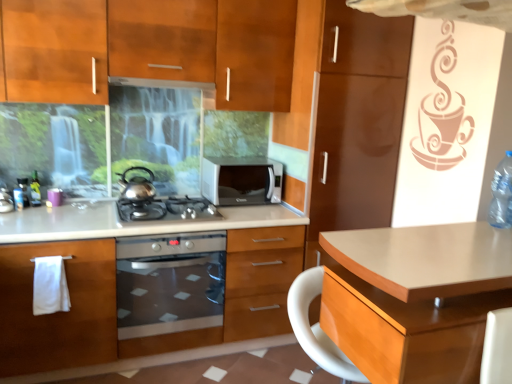
Question: Is metallic silver bottle at left, the second bottle viewed from the right, at the right side of clear plastic bottle at right, arranged as the first bottle when viewed from the right?

Choices:
 (A) no
 (B) yes

Answer: (A)

Question: Is metallic silver bottle at left, positioned as the 1th bottle in left-to-right order, far from clear plastic bottle at right, which ranks as the first bottle in front-to-back order?

Choices:
 (A) yes
 (B) no

Answer: (A)

Question: From the image's perspective, is metallic silver bottle at left, the second bottle viewed from the right, below clear plastic bottle at right, arranged as the first bottle when viewed from the right?

Choices:
 (A) yes
 (B) no

Answer: (B)

Question: Does metallic silver bottle at left, positioned as the 1th bottle in left-to-right order, lie behind clear plastic bottle at right, placed as the second bottle when sorted from left to right?

Choices:
 (A) yes
 (B) no

Answer: (A)

Question: Can you confirm if metallic silver bottle at left, which is the 1th bottle in back-to-front order, is smaller than clear plastic bottle at right, arranged as the first bottle when viewed from the right?

Choices:
 (A) yes
 (B) no

Answer: (A)

Question: Is metallic silver bottle at left, the second bottle viewed from the right, taller than clear plastic bottle at right, which ranks as the first bottle in front-to-back order?

Choices:
 (A) no
 (B) yes

Answer: (A)

Question: Considering the relative positions of matte wood desk at center and satin silver microwave at center in the image provided, is matte wood desk at center to the right of satin silver microwave at center from the viewer's perspective?

Choices:
 (A) yes
 (B) no

Answer: (A)

Question: Does matte wood desk at center come in front of satin silver microwave at center?

Choices:
 (A) no
 (B) yes

Answer: (B)

Question: Would you say satin silver microwave at center is part of matte wood desk at center's contents?

Choices:
 (A) no
 (B) yes

Answer: (A)

Question: From a real-world perspective, is matte wood desk at center physically below satin silver microwave at center?

Choices:
 (A) yes
 (B) no

Answer: (A)

Question: Does matte wood desk at center lie behind satin silver microwave at center?

Choices:
 (A) yes
 (B) no

Answer: (B)

Question: Is matte wood desk at center completely or partially outside of satin silver microwave at center?

Choices:
 (A) no
 (B) yes

Answer: (B)

Question: Is matte wood desk at center with satin silver gas stove at center?

Choices:
 (A) no
 (B) yes

Answer: (A)